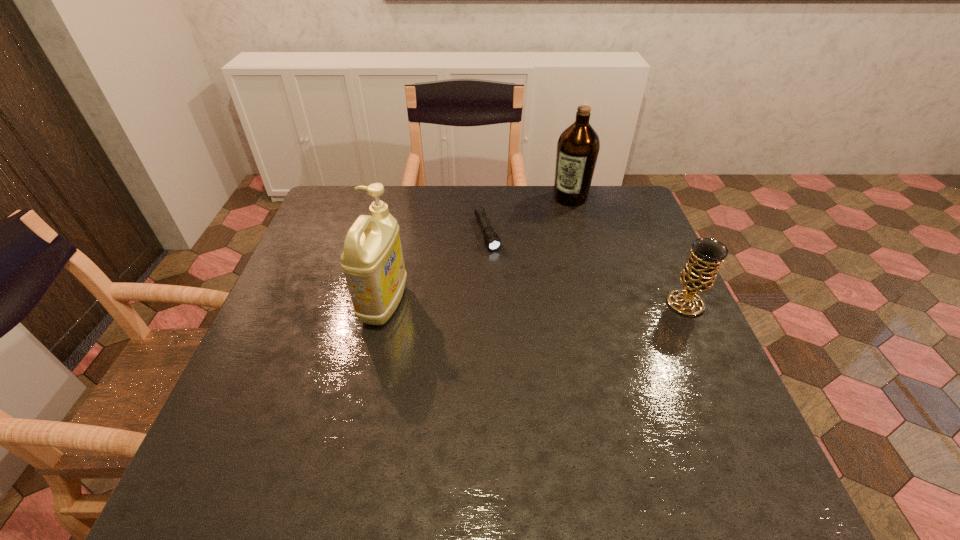
Where is `free space at the far edge of the desktop`? The width and height of the screenshot is (960, 540). free space at the far edge of the desktop is located at coordinates (498, 222).

Image resolution: width=960 pixels, height=540 pixels. Identify the location of vacant space at the near edge. (620, 417).

Identify the location of vacant space at the left edge of the desktop. The image size is (960, 540). (330, 232).

The width and height of the screenshot is (960, 540). I want to click on vacant space at the right edge, so click(x=643, y=352).

I want to click on vacant space at the far left corner of the desktop, so click(350, 202).

Where is `vacant space at the far right corner of the desktop`? Image resolution: width=960 pixels, height=540 pixels. vacant space at the far right corner of the desktop is located at coordinates (632, 205).

Locate an element on the screen. The height and width of the screenshot is (540, 960). empty location between the detergent and the farthest object is located at coordinates (477, 251).

At what (x,y) coordinates should I click in order to perform the action: click on vacant area that lies between the leftmost object and the rightmost object. Please return your answer as a coordinate pair (x, y). Looking at the image, I should click on (535, 304).

The image size is (960, 540). What are the coordinates of `free spot between the olive oil and the chalice` in the screenshot? It's located at (628, 251).

You are a GUI agent. You are given a task and a screenshot of the screen. Output one action in this format:
    pyautogui.click(x=<x>, y=<y>)
    Task: Click on the free space between the third tallest object and the third object from right to left
    This screenshot has height=540, width=960.
    Given the screenshot: What is the action you would take?
    pyautogui.click(x=587, y=269)